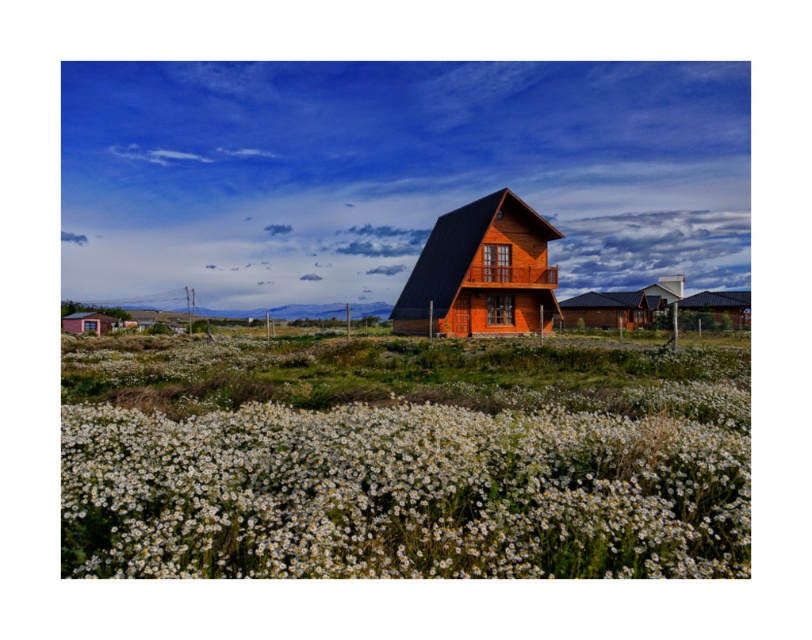
Question: Does white fluffy petals at lower center appear on the left side of brown wooden hut at center?

Choices:
 (A) yes
 (B) no

Answer: (A)

Question: Which of the following is the closest to the observer?

Choices:
 (A) [709, 326]
 (B) [67, 330]
 (C) [586, 481]
 (D) [590, 305]

Answer: (C)

Question: Can you confirm if white fluffy petals at lower center is wider than matte wooden hut at center?

Choices:
 (A) yes
 (B) no

Answer: (B)

Question: Which of the following is the closest to the observer?

Choices:
 (A) (523, 272)
 (B) (586, 324)

Answer: (A)

Question: Which point is farther from the camera taking this photo?

Choices:
 (A) (582, 307)
 (B) (534, 291)
 (C) (655, 424)
 (D) (733, 296)

Answer: (D)

Question: Is wooden cabin at right to the right of matte pink hut at lower left from the viewer's perspective?

Choices:
 (A) yes
 (B) no

Answer: (A)